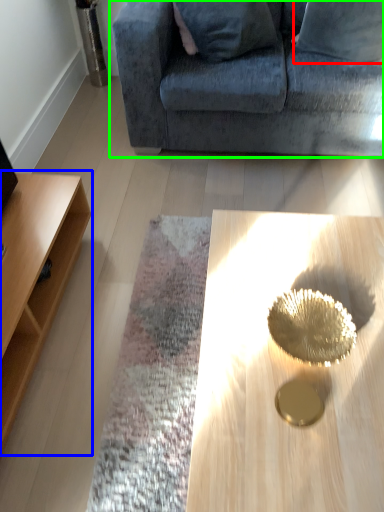
Question: Which is nearer to the pillow (highlighted by a red box)? table (highlighted by a blue box) or studio couch (highlighted by a green box).

Choices:
 (A) table
 (B) studio couch

Answer: (B)